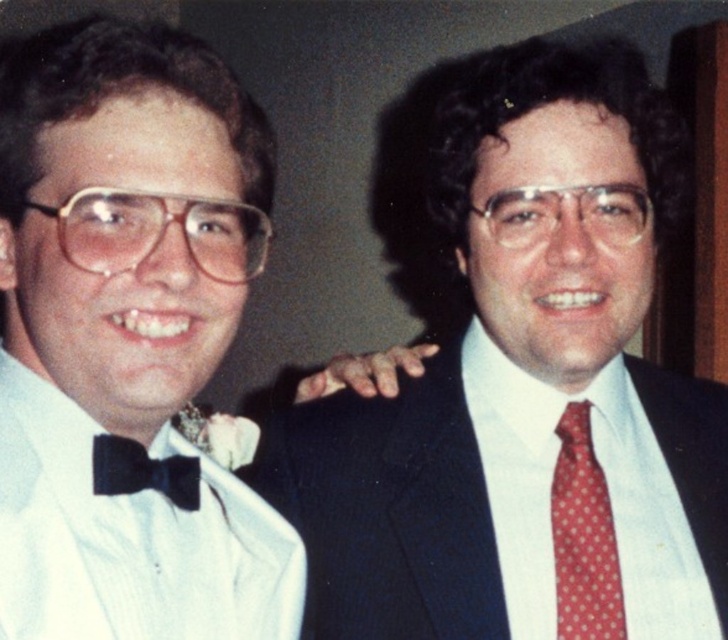
Question: Which object is farther from the camera taking this photo?

Choices:
 (A) black satin bow tie at left
 (B) white satin bow tie at left
 (C) red dotted fabric tie at right

Answer: (C)

Question: Is the position of white satin bow tie at left less distant than that of red dotted fabric tie at right?

Choices:
 (A) yes
 (B) no

Answer: (A)

Question: Can you confirm if white satin bow tie at left is wider than red dotted fabric tie at right?

Choices:
 (A) yes
 (B) no

Answer: (A)

Question: Which object is closer to the camera taking this photo?

Choices:
 (A) black satin bow tie at left
 (B) white satin bow tie at left

Answer: (A)

Question: Which point is farther to the camera?

Choices:
 (A) (178, 465)
 (B) (276, 456)
 (C) (557, 582)

Answer: (B)

Question: Where is red dotted fabric tie at right located in relation to black satin bow tie at left in the image?

Choices:
 (A) left
 (B) right

Answer: (B)